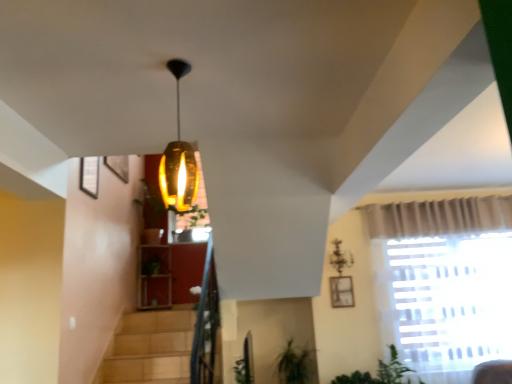
Question: From the image's perspective, does wooden frame at upper right appear higher than metallic chandelier at upper center?

Choices:
 (A) yes
 (B) no

Answer: (B)

Question: Is wooden frame at upper right positioned in front of metallic chandelier at upper center?

Choices:
 (A) no
 (B) yes

Answer: (A)

Question: Considering the relative positions of wooden frame at upper right and metallic chandelier at upper center in the image provided, is wooden frame at upper right to the left of metallic chandelier at upper center from the viewer's perspective?

Choices:
 (A) no
 (B) yes

Answer: (A)

Question: Is wooden frame at upper right bigger than metallic chandelier at upper center?

Choices:
 (A) no
 (B) yes

Answer: (A)

Question: Is wooden frame at upper right wider than metallic chandelier at upper center?

Choices:
 (A) yes
 (B) no

Answer: (B)

Question: From a real-world perspective, is wooden frame at upper right on top of metallic chandelier at upper center?

Choices:
 (A) no
 (B) yes

Answer: (A)

Question: Does metallic chandelier at upper center appear on the left side of wooden frame at upper right?

Choices:
 (A) yes
 (B) no

Answer: (A)

Question: Can you confirm if metallic chandelier at upper center is bigger than wooden frame at upper right?

Choices:
 (A) yes
 (B) no

Answer: (A)

Question: Is metallic chandelier at upper center not inside wooden frame at upper right?

Choices:
 (A) yes
 (B) no

Answer: (A)

Question: Is metallic chandelier at upper center closer to the viewer compared to wooden frame at upper right?

Choices:
 (A) no
 (B) yes

Answer: (B)

Question: Is metallic chandelier at upper center oriented away from wooden frame at upper right?

Choices:
 (A) yes
 (B) no

Answer: (B)

Question: Can you confirm if metallic chandelier at upper center is thinner than wooden frame at upper right?

Choices:
 (A) no
 (B) yes

Answer: (A)

Question: Based on their positions, is metallic chandelier at upper center located to the left or right of wooden frame at upper right?

Choices:
 (A) right
 (B) left

Answer: (B)